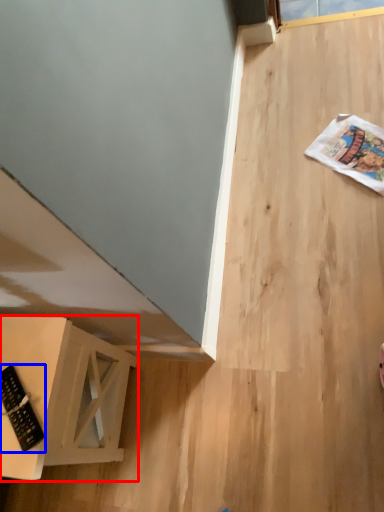
Question: Which object appears farthest to the camera in this image, furniture (highlighted by a red box) or control (highlighted by a blue box)?

Choices:
 (A) furniture
 (B) control

Answer: (B)